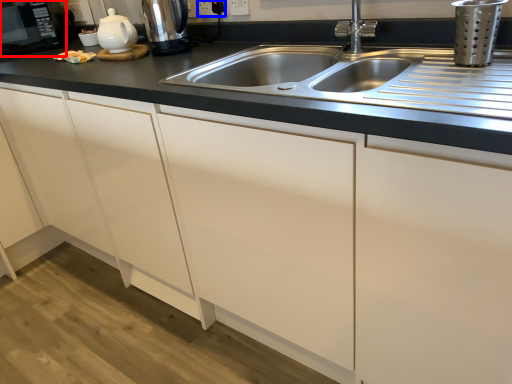
Question: Among these objects, which one is nearest to the camera, appliance (highlighted by a red box) or electric outlet (highlighted by a blue box)?

Choices:
 (A) appliance
 (B) electric outlet

Answer: (B)